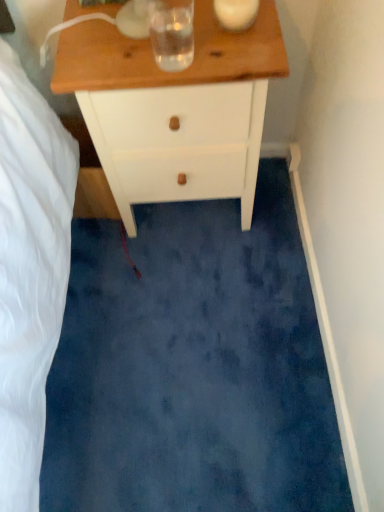
Question: Considering the positions of white wood chest of drawers at upper center and clear glass water at upper center in the image, is white wood chest of drawers at upper center wider or thinner than clear glass water at upper center?

Choices:
 (A) thin
 (B) wide

Answer: (B)

Question: From a real-world perspective, is white wood chest of drawers at upper center positioned above or below clear glass water at upper center?

Choices:
 (A) below
 (B) above

Answer: (A)

Question: Considering the positions of white wood chest of drawers at upper center and clear glass water at upper center in the image, is white wood chest of drawers at upper center bigger or smaller than clear glass water at upper center?

Choices:
 (A) big
 (B) small

Answer: (A)

Question: Is clear glass water at upper center to the left or to the right of white wood chest of drawers at upper center in the image?

Choices:
 (A) left
 (B) right

Answer: (A)

Question: From the image's perspective, is clear glass water at upper center located above or below white wood chest of drawers at upper center?

Choices:
 (A) below
 (B) above

Answer: (B)

Question: Is clear glass water at upper center taller or shorter than white wood chest of drawers at upper center?

Choices:
 (A) short
 (B) tall

Answer: (A)

Question: Considering the positions of clear glass water at upper center and white wood chest of drawers at upper center in the image, is clear glass water at upper center bigger or smaller than white wood chest of drawers at upper center?

Choices:
 (A) big
 (B) small

Answer: (B)